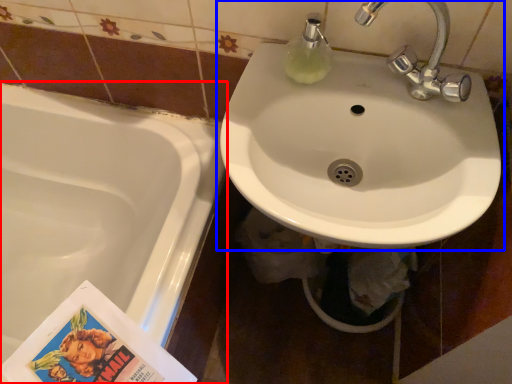
Question: Which object is closer to the camera taking this photo, bathtub (highlighted by a red box) or sink (highlighted by a blue box)?

Choices:
 (A) bathtub
 (B) sink

Answer: (B)